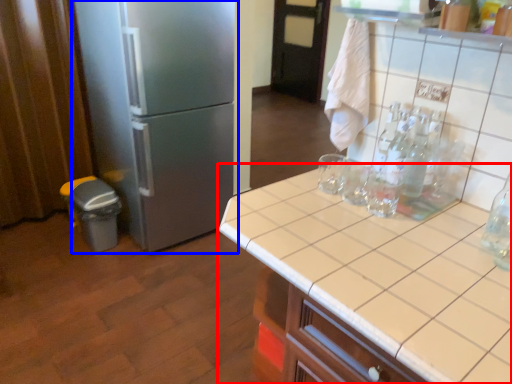
Question: Among these objects, which one is nearest to the camera, countertop (highlighted by a red box) or refrigerator (highlighted by a blue box)?

Choices:
 (A) countertop
 (B) refrigerator

Answer: (A)